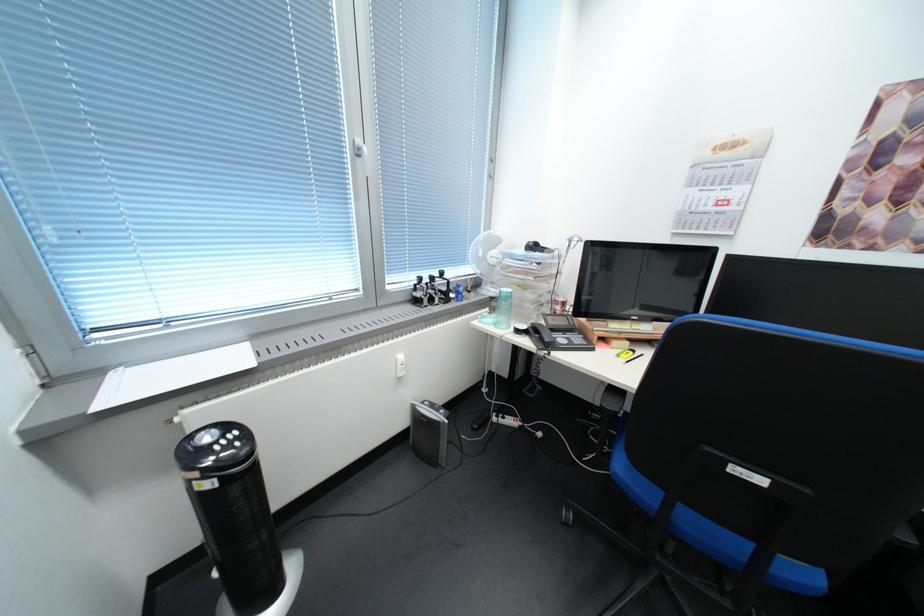
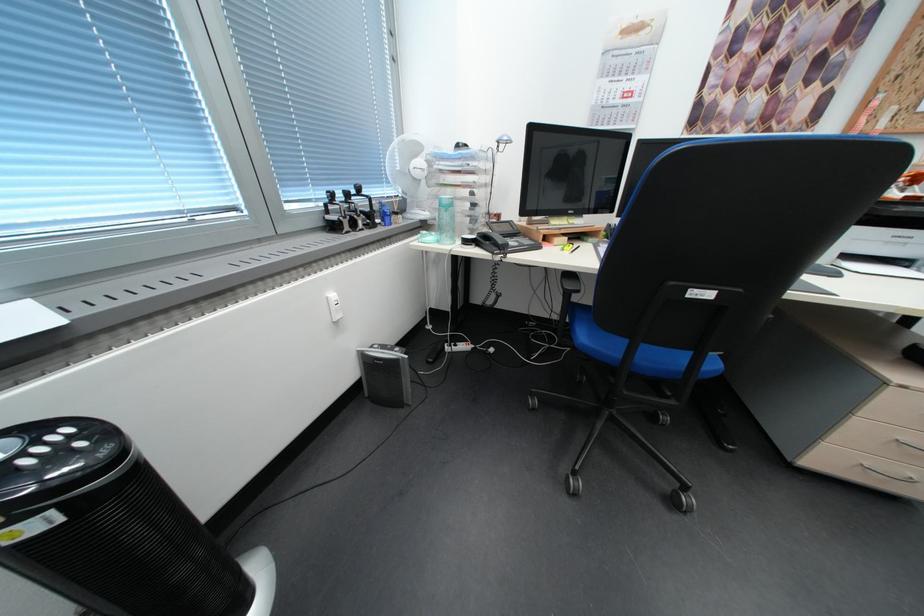
In the second image, find the point that corresponds to point (423, 286) in the first image.

(333, 206)